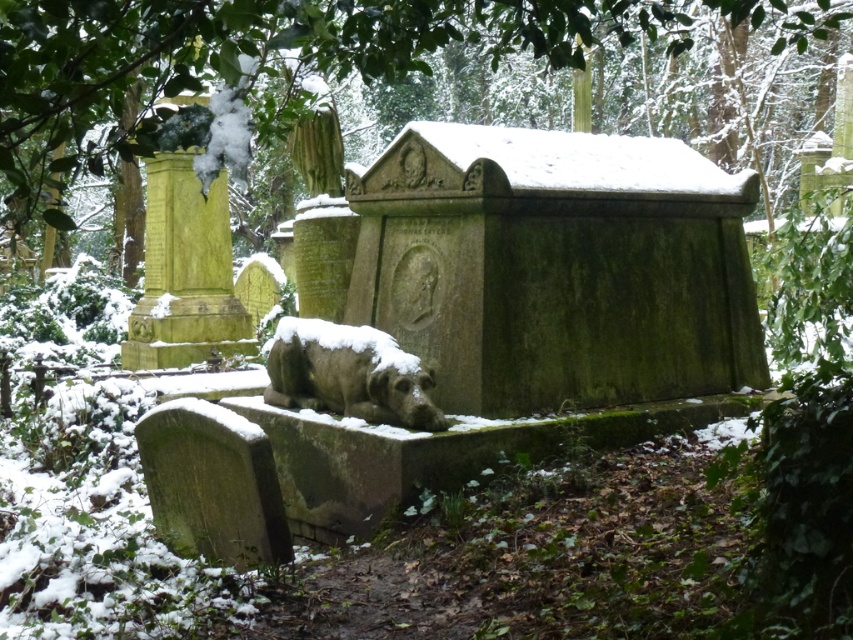
Looking at this image, you are a visitor to the cemetery and want to take a photo of both the green mossy tree at upper center and the slate gray stone dog at center. Which object should you focus on first to ensure both are in the frame?

The green mossy tree at upper center is taller than the slate gray stone dog at center, so you should focus on the green mossy tree at upper center first to ensure both are in the frame.

You are standing in the winter cemetery scene and want to take a photo of the two points mentioned. Which point, point (112, 99) or point (315, 368), will appear larger in your camera view?

Point (112, 99) will appear larger in your camera view because it is closer to the camera than point (315, 368).

You are standing in the winter cemetery scene. There is a green mossy tree at upper center. If you want to reach the tree, how many steps would you need to take if each step covers 0.75 meters?

The green mossy tree at upper center is 3.38 meters away from the viewer. Since each step covers 0.75 meters, dividing 3.38 by 0.75 gives approximately 4.5 steps. Therefore, you would need to take 5 steps to reach the tree.